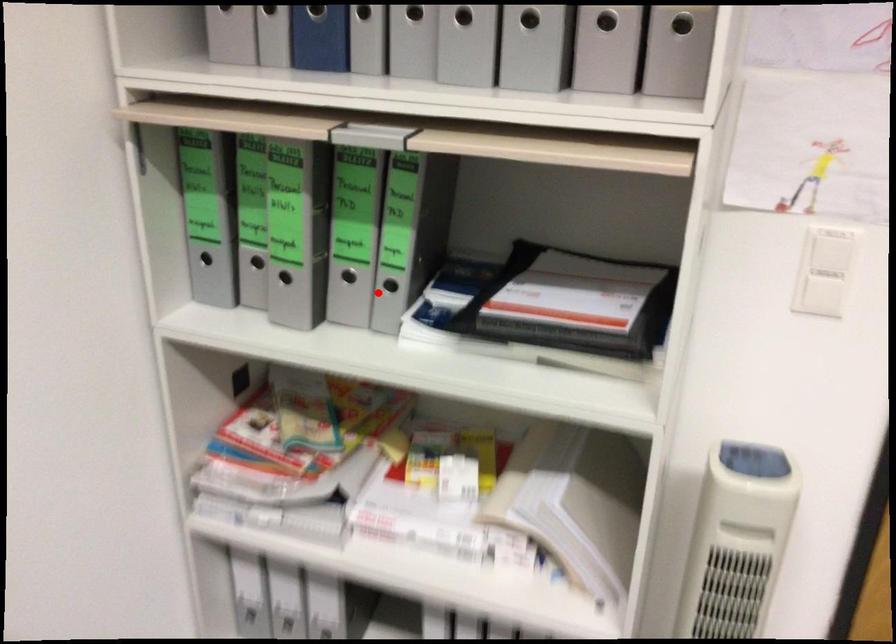
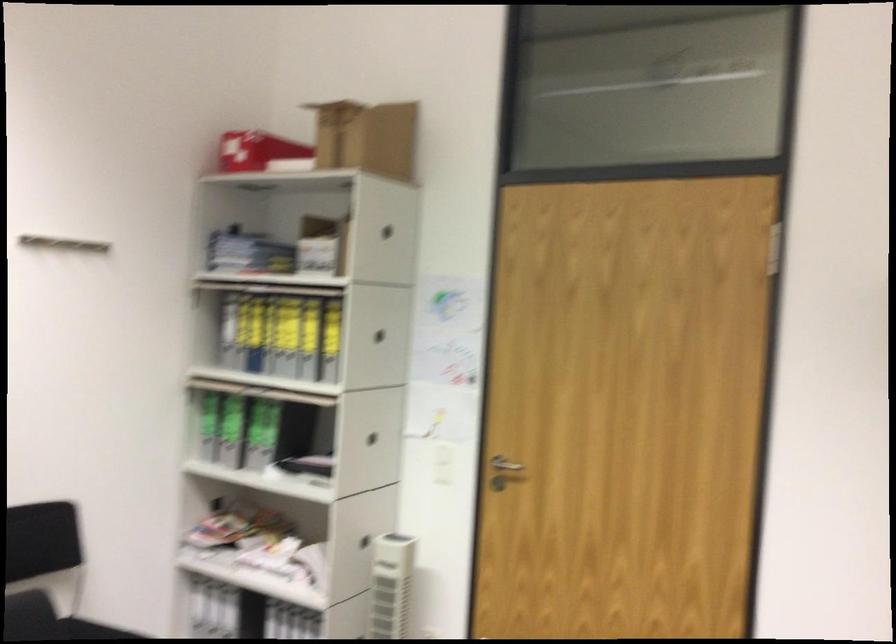
Question: I am providing you with two images of the same scene from different viewpoints. In image1, a red point is highlighted. Considering the same 3D point in image2, which of the following is correct?

Choices:
 (A) It is closer
 (B) It is farther

Answer: (B)